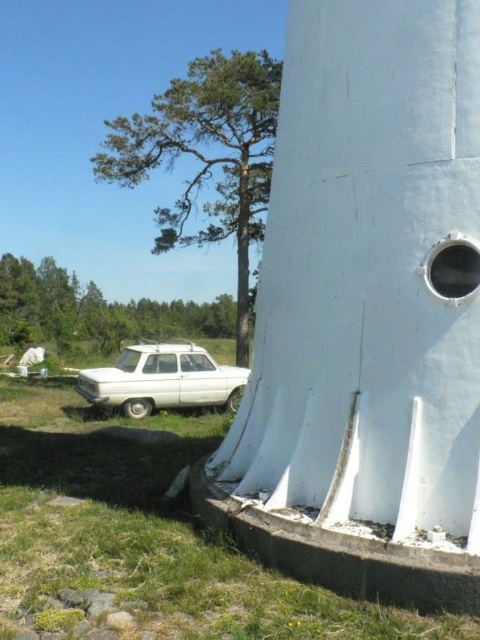
Can you confirm if green grass at lower left is taller than white matte sedan at lower left?

Correct, green grass at lower left is much taller as white matte sedan at lower left.

Does point (141, 529) come closer to viewer compared to point (129, 406)?

Yes, it is.

Where is `green grass at lower left`? Image resolution: width=480 pixels, height=640 pixels. green grass at lower left is located at coordinates (142, 536).

Locate an element on the screen. green grass at lower left is located at coordinates (142, 536).

Can you confirm if white matte sedan at lower left is wider than metallic circular hole at right?

Yes, white matte sedan at lower left is wider than metallic circular hole at right.

Between white matte sedan at lower left and metallic circular hole at right, which one is positioned lower?

white matte sedan at lower left is below.

Is point (194, 364) positioned in front of point (454, 236)?

No, it is not.

This screenshot has width=480, height=640. I want to click on white matte sedan at lower left, so click(x=163, y=380).

Who is taller, green grass at lower left or green leafy tree at lower left?

Standing taller between the two is green leafy tree at lower left.

Does point (23, 547) come behind point (64, 269)?

No, it is not.

Find the location of a particular element. green grass at lower left is located at coordinates (142, 536).